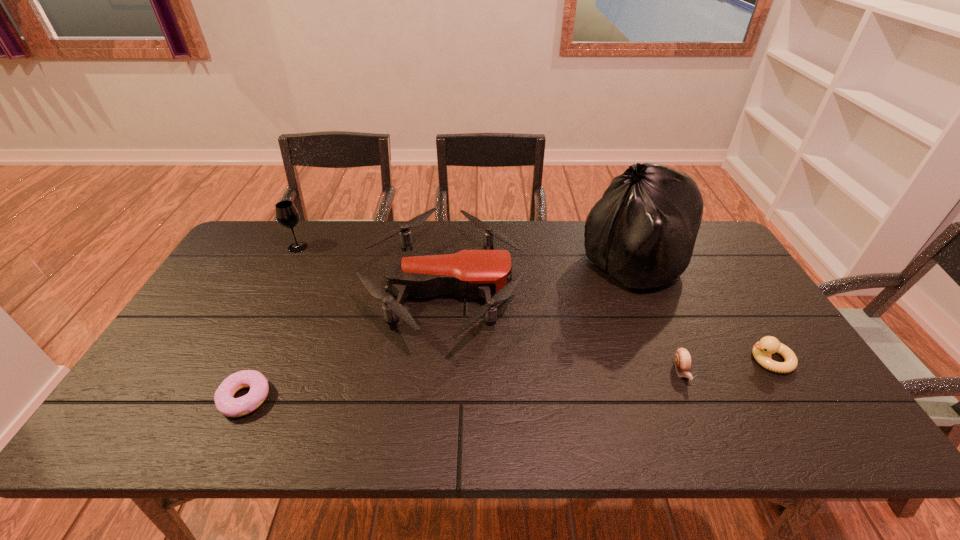
The image size is (960, 540). I want to click on plastic bag located at the right edge, so click(x=642, y=232).

This screenshot has width=960, height=540. I want to click on duckling positioned at the right edge, so click(762, 350).

At what (x,y) coordinates should I click in order to perform the action: click on object located in the far right corner section of the desktop. Please return your answer as a coordinate pair (x, y). Image resolution: width=960 pixels, height=540 pixels. Looking at the image, I should click on (642, 232).

Locate an element on the screen. The width and height of the screenshot is (960, 540). vacant position at the far edge of the desktop is located at coordinates point(417,228).

I want to click on vacant point at the near edge, so click(x=393, y=435).

Where is `free space at the left edge`? The height and width of the screenshot is (540, 960). free space at the left edge is located at coordinates (222, 334).

This screenshot has width=960, height=540. In the image, there is a desktop. Find the location of `vacant space at the right edge`. vacant space at the right edge is located at coordinates (723, 331).

Identify the location of vacant space at the far left corner. This screenshot has height=540, width=960. (276, 250).

In the image, there is a desktop. Where is `vacant space at the near left corner`? The height and width of the screenshot is (540, 960). vacant space at the near left corner is located at coordinates (146, 411).

Locate an element on the screen. The image size is (960, 540). empty space between the second tallest object and the shortest object is located at coordinates (272, 323).